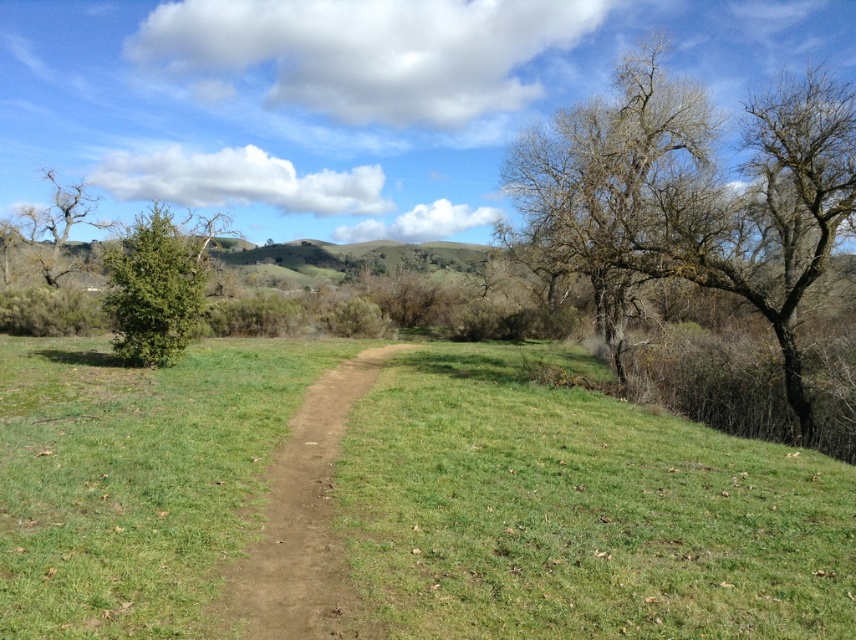
You are planning to walk along the brown dirt track at center while avoiding the bare branches at upper left. Given their widths, which path is narrower?

The brown dirt track at center is narrower than the bare branches at upper left since it has a lesser width compared to them.

You are a bird flying over the rural landscape shown in the image. You want to land on the bare branches at upper right. What are the coordinates of the spot where you should aim to land?

The coordinates of the spot where you should aim to land on the bare branches at upper right are at point [608,180].

You are a hiker trying to follow the path in this rural landscape. The brown dirt track at center is your route. There are also bare branches at upper left that might block your view. Which of the two objects is smaller in size?

The brown dirt track at center is smaller than the bare branches at upper left, so the dirt track is smaller in size.